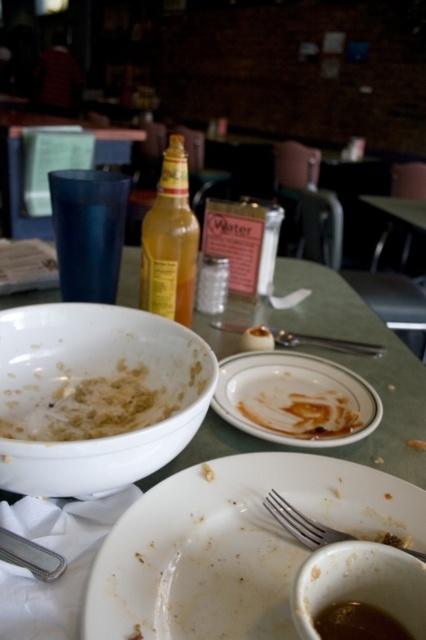
You are a waiter at a diner and you need to clean the table. The white glossy plate at center is located at point (296, 397). Where exactly should you start cleaning first?

The white glossy plate at center is located at point (296, 397), so you should start cleaning at that coordinate.

You are sitting at the table and want to reach for both items located at point (313, 520) and point (368, 342). Which point will you reach first if you start from your current position?

Point (313, 520) is in front of point (368, 342), so you will reach it first.

You are a waiter at the diner and need to clear the table. The silver metallic fork at lower center is blocking access to the cup behind it. Based on its position, can you estimate whether the fork is closer to the edge of the table or near the center?

The silver metallic fork at lower center is located at point (302, 524), which suggests it is closer to the edge of the table rather than the center. Therefore, moving it should allow access to the cup behind it.